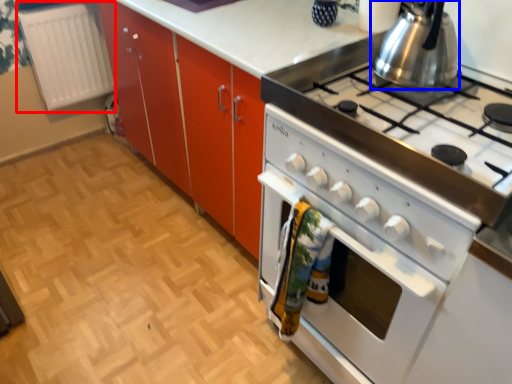
Question: Which point is further to the camera, radiator (highlighted by a red box) or kitchen appliance (highlighted by a blue box)?

Choices:
 (A) radiator
 (B) kitchen appliance

Answer: (A)